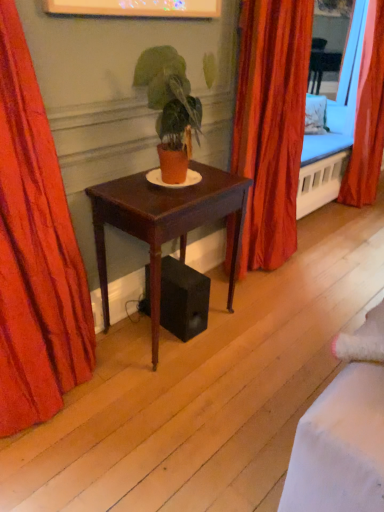
At what (x,y) coordinates should I click in order to perform the action: click on unoccupied region to the right of silky orange curtain at center, which ranks as the 2th curtain in back-to-front order. Please return your answer as a coordinate pair (x, y). Looking at the image, I should click on (324, 264).